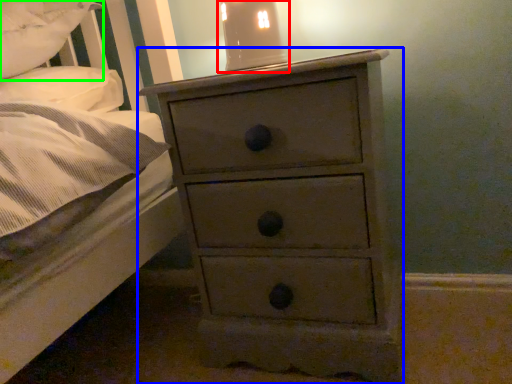
Question: Considering the real-world distances, which object is farthest from bedside lamp (highlighted by a red box)? chest of drawers (highlighted by a blue box) or pillow (highlighted by a green box)?

Choices:
 (A) chest of drawers
 (B) pillow

Answer: (B)